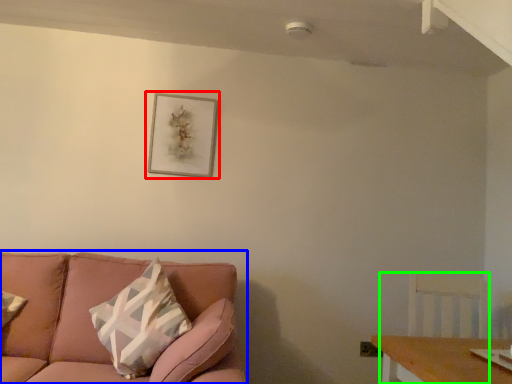
Question: Which object is positioned closest to picture frame (highlighted by a red box)? Select from studio couch (highlighted by a blue box) and swivel chair (highlighted by a green box).

Choices:
 (A) studio couch
 (B) swivel chair

Answer: (A)